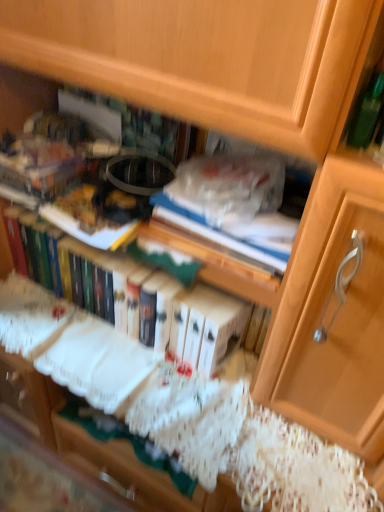
Question: Is blue hardcover book at center further to the viewer compared to hardcover book at center?

Choices:
 (A) no
 (B) yes

Answer: (A)

Question: From the image's perspective, would you say blue hardcover book at center is positioned over hardcover book at center?

Choices:
 (A) no
 (B) yes

Answer: (B)

Question: Is blue hardcover book at center aimed at hardcover book at center?

Choices:
 (A) yes
 (B) no

Answer: (B)

Question: Would you say blue hardcover book at center is a long distance from hardcover book at center?

Choices:
 (A) no
 (B) yes

Answer: (A)

Question: From a real-world perspective, is blue hardcover book at center positioned over hardcover book at center based on gravity?

Choices:
 (A) no
 (B) yes

Answer: (B)

Question: Does blue hardcover book at center come in front of hardcover book at center?

Choices:
 (A) yes
 (B) no

Answer: (A)

Question: Is hardcover book at center next to blue hardcover book at center and touching it?

Choices:
 (A) yes
 (B) no

Answer: (B)

Question: Considering the relative positions of hardcover book at center and blue hardcover book at center in the image provided, is hardcover book at center to the right of blue hardcover book at center from the viewer's perspective?

Choices:
 (A) no
 (B) yes

Answer: (A)

Question: Can you confirm if hardcover book at center is wider than blue hardcover book at center?

Choices:
 (A) no
 (B) yes

Answer: (B)

Question: From the image's perspective, is hardcover book at center located above blue hardcover book at center?

Choices:
 (A) yes
 (B) no

Answer: (B)

Question: Would you say blue hardcover book at center is part of hardcover book at center's contents?

Choices:
 (A) yes
 (B) no

Answer: (B)

Question: Considering the relative positions of hardcover book at center and blue hardcover book at center in the image provided, is hardcover book at center behind blue hardcover book at center?

Choices:
 (A) no
 (B) yes

Answer: (B)

Question: Considering the positions of hardcover book at center and blue hardcover book at center in the image, is hardcover book at center wider or thinner than blue hardcover book at center?

Choices:
 (A) wide
 (B) thin

Answer: (A)